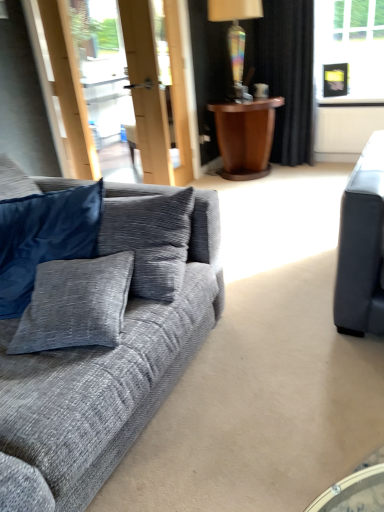
In order to face black velvet curtain at upper right, should I rotate leftwards or rightwards?

To align with it, rotate right about 12.371°.

This screenshot has height=512, width=384. What do you see at coordinates (287, 75) in the screenshot? I see `black velvet curtain at upper right` at bounding box center [287, 75].

Identify the location of textured gray couch at left. pos(105,343).

Find the location of a particular element. The height and width of the screenshot is (512, 384). black velvet curtain at upper right is located at coordinates point(287,75).

Looking at this image, from a real-world perspective, between velvet blue pillow at left and rainbow glass lamp at upper center, who is vertically lower?

velvet blue pillow at left is physically lower.

Measure the distance between velvet blue pillow at left and rainbow glass lamp at upper center.

velvet blue pillow at left is 8.15 feet away from rainbow glass lamp at upper center.

Does velvet blue pillow at left turn towards rainbow glass lamp at upper center?

No, velvet blue pillow at left is not aimed at rainbow glass lamp at upper center.

What's the angular difference between textured gray couch at left and rainbow glass lamp at upper center's facing directions?

The facing directions of textured gray couch at left and rainbow glass lamp at upper center are 0.545 degrees apart.

Looking at this image, which object is positioned more to the left, textured gray couch at left or rainbow glass lamp at upper center?

textured gray couch at left.

Is point (105, 310) farther from camera compared to point (230, 50)?

No, it is not.

Is textured gray couch at left turned away from rainbow glass lamp at upper center?

No, textured gray couch at left is not facing the opposite direction of rainbow glass lamp at upper center.

Image resolution: width=384 pixels, height=512 pixels. Find the location of `studio couch below the black velvet curtain at upper right (from the image's perspective)`. studio couch below the black velvet curtain at upper right (from the image's perspective) is located at coordinates (105, 343).

From a real-world perspective, relative to textured gray couch at left, is black velvet curtain at upper right vertically above or below?

black velvet curtain at upper right is above textured gray couch at left.

Does black velvet curtain at upper right appear on the left side of textured gray couch at left?

No.

Is there a large distance between rainbow glass lamp at upper center and textured gray couch at left?

Yes.

From the image's perspective, which is above, rainbow glass lamp at upper center or textured gray couch at left?

rainbow glass lamp at upper center, from the image's perspective.

Considering the sizes of objects rainbow glass lamp at upper center and textured gray couch at left in the image provided, who is bigger, rainbow glass lamp at upper center or textured gray couch at left?

With larger size is textured gray couch at left.

From the image's perspective, is textured gray couch at left above velvet blue pillow at left?

No, from the image's perspective, textured gray couch at left is not on top of velvet blue pillow at left.

Which is closer to the camera, (101,477) or (11,228)?

The point (101,477) is in front.

From the picture: In terms of height, does textured gray couch at left look taller or shorter compared to velvet blue pillow at left?

textured gray couch at left is taller than velvet blue pillow at left.

Is textured gray couch at left located outside velvet blue pillow at left?

Absolutely, textured gray couch at left is external to velvet blue pillow at left.

From the image's perspective, which is below, brown wooden side table at upper center or black velvet curtain at upper right?

From the image's view, brown wooden side table at upper center is below.

In terms of size, does brown wooden side table at upper center appear bigger or smaller than black velvet curtain at upper right?

Clearly, brown wooden side table at upper center is larger in size than black velvet curtain at upper right.

Who is taller, brown wooden side table at upper center or black velvet curtain at upper right?

With more height is black velvet curtain at upper right.

How different are the orientations of brown wooden side table at upper center and black velvet curtain at upper right in degrees?

They differ by 89.8 degrees in their facing directions.

Is rainbow glass lamp at upper center to the left or to the right of brown wooden side table at upper center in the image?

In the image, rainbow glass lamp at upper center appears on the left side of brown wooden side table at upper center.

From a real-world perspective, does rainbow glass lamp at upper center sit lower than brown wooden side table at upper center?

No, from a real-world perspective, rainbow glass lamp at upper center is not beneath brown wooden side table at upper center.

Where is `pillow located underneath the rainbow glass lamp at upper center (from a real-world perspective)`? The width and height of the screenshot is (384, 512). pillow located underneath the rainbow glass lamp at upper center (from a real-world perspective) is located at coordinates (44, 238).

The image size is (384, 512). I want to click on lamp above the textured gray couch at left (from the image's perspective), so click(236, 35).

Looking at this image, when comparing their distances from textured gray couch at left, does velvet blue pillow at left or black velvet curtain at upper right seem further?

black velvet curtain at upper right is further to textured gray couch at left.

When comparing their distances from brown wooden side table at upper center, does velvet blue pillow at left or rainbow glass lamp at upper center seem closer?

Based on the image, rainbow glass lamp at upper center appears to be nearer to brown wooden side table at upper center.

Which object lies nearer to the anchor point brown wooden side table at upper center, textured gray couch at left or black velvet curtain at upper right?

black velvet curtain at upper right is closer to brown wooden side table at upper center.

Looking at the image, which one is located further to rainbow glass lamp at upper center, textured gray couch at left or brown wooden side table at upper center?

Among the two, textured gray couch at left is located further to rainbow glass lamp at upper center.

When comparing their distances from rainbow glass lamp at upper center, does textured gray couch at left or black velvet curtain at upper right seem further?

textured gray couch at left is positioned further to the anchor rainbow glass lamp at upper center.

Looking at the image, which one is located closer to rainbow glass lamp at upper center, black velvet curtain at upper right or textured gray couch at left?

black velvet curtain at upper right lies closer to rainbow glass lamp at upper center than the other object.

Based on their spatial positions, is brown wooden side table at upper center or black velvet curtain at upper right closer to velvet blue pillow at left?

brown wooden side table at upper center.

From the picture: Which object lies nearer to the anchor point velvet blue pillow at left, textured gray couch at left or black velvet curtain at upper right?

Based on the image, textured gray couch at left appears to be nearer to velvet blue pillow at left.

Identify the location of curtain between rainbow glass lamp at upper center and brown wooden side table at upper center in the vertical direction. The height and width of the screenshot is (512, 384). (287, 75).

At what (x,y) coordinates should I click in order to perform the action: click on curtain between textured gray couch at left and brown wooden side table at upper center from front to back. Please return your answer as a coordinate pair (x, y). This screenshot has height=512, width=384. Looking at the image, I should click on (287, 75).

This screenshot has height=512, width=384. In order to click on pillow located between textured gray couch at left and brown wooden side table at upper center in the depth direction in this screenshot , I will do `click(44, 238)`.

Where is `lamp located between velvet blue pillow at left and black velvet curtain at upper right in the depth direction`? Image resolution: width=384 pixels, height=512 pixels. lamp located between velvet blue pillow at left and black velvet curtain at upper right in the depth direction is located at coordinates (236, 35).